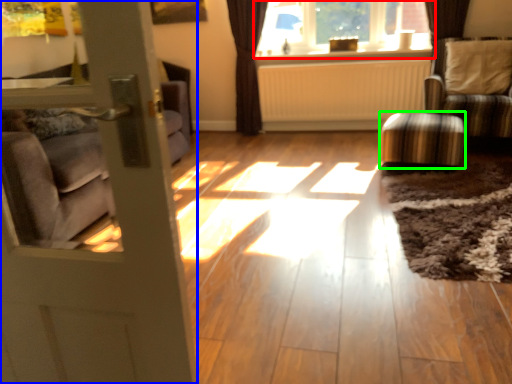
Question: Estimate the real-world distances between objects in this image. Which object is closer to window (highlighted by a red box), door (highlighted by a blue box) or stool (highlighted by a green box)?

Choices:
 (A) door
 (B) stool

Answer: (B)